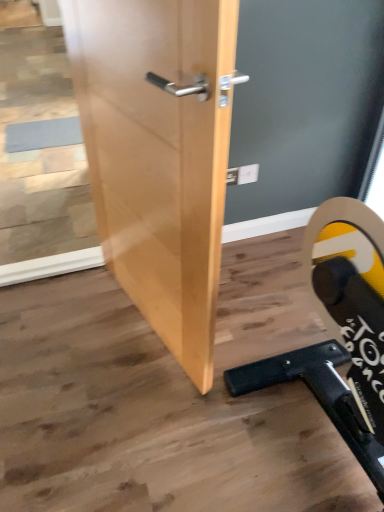
Identify the location of vacant space underneath natural wood door at center (from a real-world perspective). The image size is (384, 512). (140, 323).